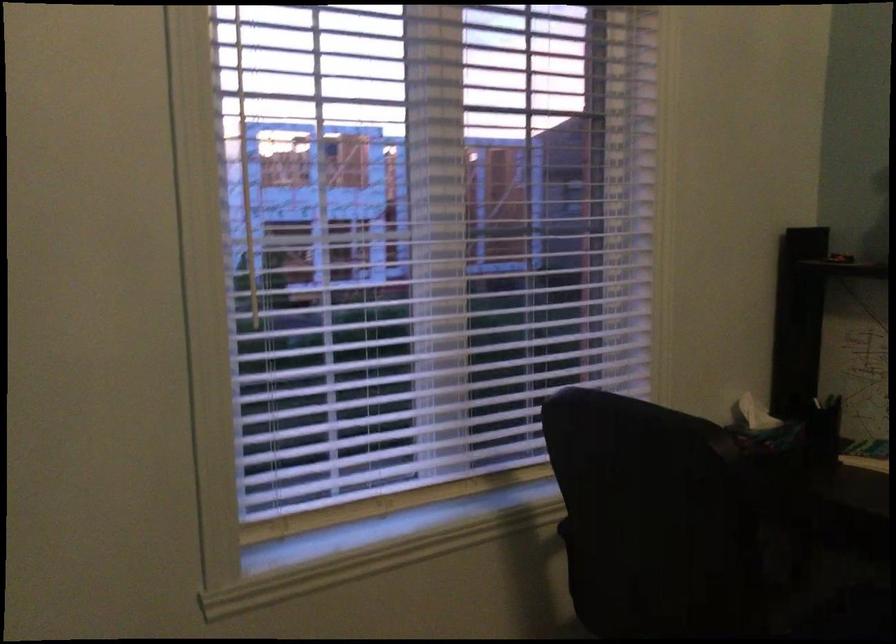
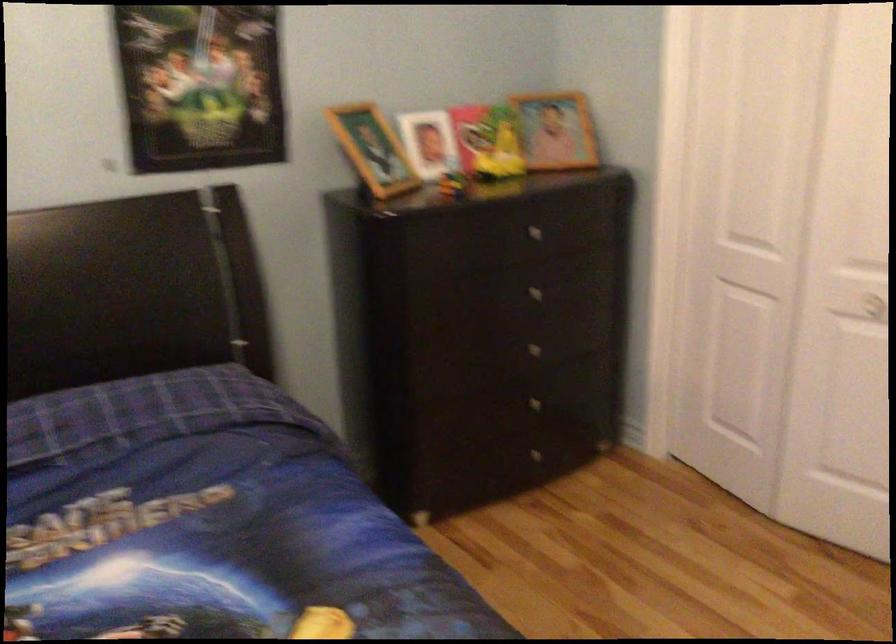
First-person continuous shooting, in which direction is the camera rotating?

The camera rotated toward right-down.